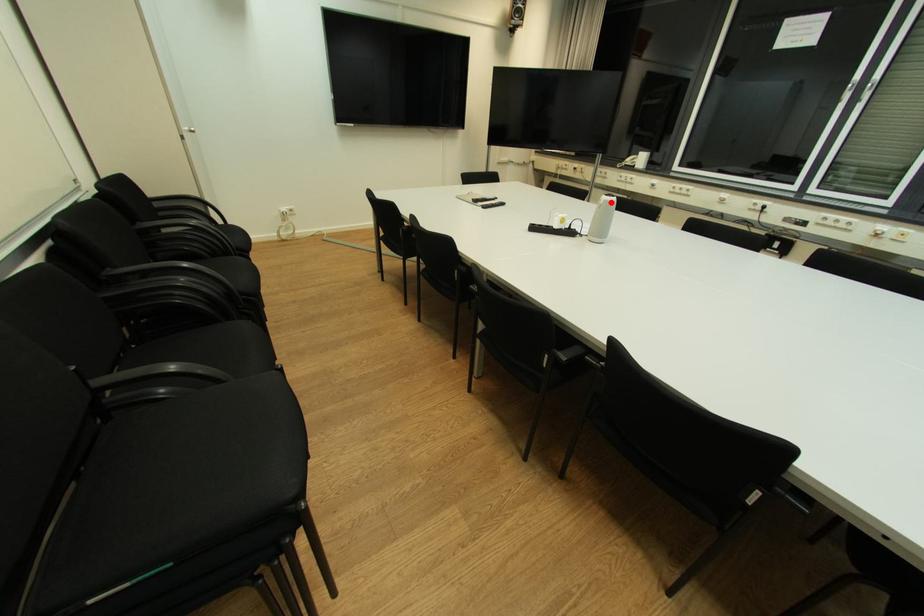
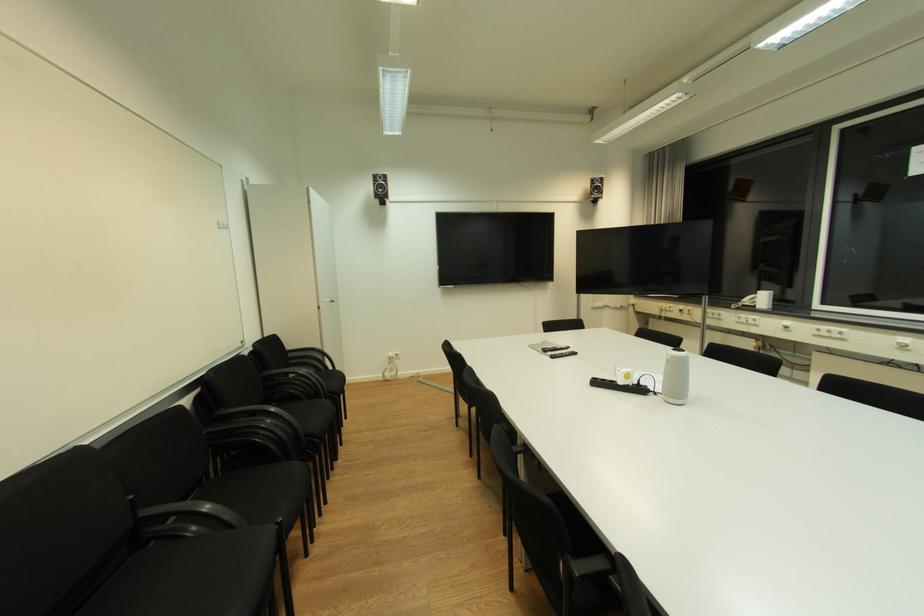
Question: I am providing you with two images of the same scene from different viewpoints. Image1 has a red point marked. In image2, the corresponding 3D location appears at what relative position? Reply with the corresponding letter.

Choices:
 (A) Closer
 (B) Farther

Answer: (B)